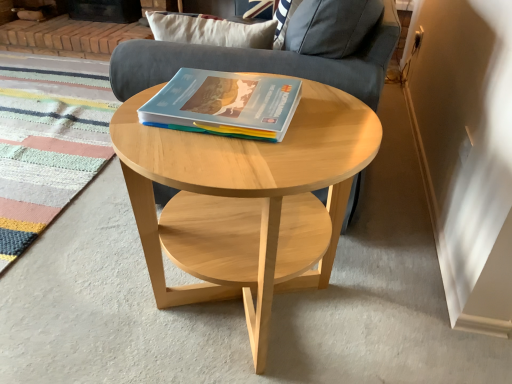
Question: Is gray fabric armchair at center positioned before multicolored woven mat at lower left?

Choices:
 (A) no
 (B) yes

Answer: (B)

Question: Is gray fabric armchair at center aimed at multicolored woven mat at lower left?

Choices:
 (A) yes
 (B) no

Answer: (A)

Question: Is gray fabric armchair at center located outside multicolored woven mat at lower left?

Choices:
 (A) yes
 (B) no

Answer: (A)

Question: Does gray fabric armchair at center come behind multicolored woven mat at lower left?

Choices:
 (A) yes
 (B) no

Answer: (B)

Question: Is gray fabric armchair at center next to multicolored woven mat at lower left?

Choices:
 (A) yes
 (B) no

Answer: (B)

Question: Is multicolored woven mat at lower left completely or partially inside gray fabric armchair at center?

Choices:
 (A) no
 (B) yes

Answer: (A)

Question: Is multicolored woven mat at lower left aimed at matte plastic book at center?

Choices:
 (A) no
 (B) yes

Answer: (A)

Question: From the image's perspective, is multicolored woven mat at lower left over matte plastic book at center?

Choices:
 (A) no
 (B) yes

Answer: (B)

Question: Considering the relative sizes of multicolored woven mat at lower left and matte plastic book at center in the image provided, is multicolored woven mat at lower left wider than matte plastic book at center?

Choices:
 (A) no
 (B) yes

Answer: (B)

Question: Is multicolored woven mat at lower left placed right next to matte plastic book at center?

Choices:
 (A) no
 (B) yes

Answer: (A)

Question: Can you confirm if multicolored woven mat at lower left is smaller than matte plastic book at center?

Choices:
 (A) yes
 (B) no

Answer: (B)

Question: Does multicolored woven mat at lower left contain matte plastic book at center?

Choices:
 (A) no
 (B) yes

Answer: (A)

Question: Is gray fabric armchair at center oriented away from natural wood coffee table at center?

Choices:
 (A) yes
 (B) no

Answer: (B)